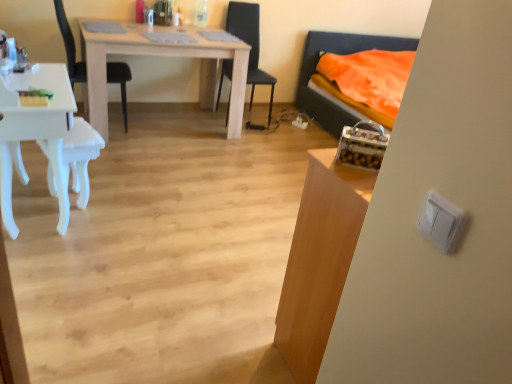
Question: Could you tell me if light wood table at center, which is the 1th table in back-to-front order, is facing black plastic chair at upper left, the 1th chair in the left-to-right sequence?

Choices:
 (A) no
 (B) yes

Answer: (A)

Question: Would you consider light wood table at center, which appears as the first table when viewed from the left, to be distant from black plastic chair at upper left, the 1th chair in the left-to-right sequence?

Choices:
 (A) yes
 (B) no

Answer: (B)

Question: From the image's perspective, would you say light wood table at center, which is the 1th table in back-to-front order, is shown under black plastic chair at upper left, the 1th chair in the left-to-right sequence?

Choices:
 (A) yes
 (B) no

Answer: (A)

Question: Does light wood table at center, arranged as the 2th table when viewed from the right, have a smaller size compared to black plastic chair at upper left, the 1th chair in the left-to-right sequence?

Choices:
 (A) no
 (B) yes

Answer: (A)

Question: Is light wood table at center, arranged as the 2th table when viewed from the right, bigger than black plastic chair at upper left, arranged as the second chair when viewed from the right?

Choices:
 (A) yes
 (B) no

Answer: (A)

Question: Is light wood table at center, which is the 2th table in front-to-back order, positioned before black plastic chair at upper left, the 1th chair in the left-to-right sequence?

Choices:
 (A) no
 (B) yes

Answer: (B)

Question: Is the position of white plastic light switch at right more distant than that of white glossy armchair at lower left?

Choices:
 (A) no
 (B) yes

Answer: (A)

Question: From the image's perspective, is white plastic light switch at right below white glossy armchair at lower left?

Choices:
 (A) no
 (B) yes

Answer: (B)

Question: Can you confirm if white plastic light switch at right is thinner than white glossy armchair at lower left?

Choices:
 (A) no
 (B) yes

Answer: (B)

Question: From the image's perspective, does white plastic light switch at right appear higher than white glossy armchair at lower left?

Choices:
 (A) yes
 (B) no

Answer: (B)

Question: Can you confirm if white plastic light switch at right is shorter than white glossy armchair at lower left?

Choices:
 (A) no
 (B) yes

Answer: (B)

Question: Would you say white glossy armchair at lower left is part of white plastic light switch at right's contents?

Choices:
 (A) no
 (B) yes

Answer: (A)

Question: Is white plastic light switch at right taller than white glossy desk at left?

Choices:
 (A) yes
 (B) no

Answer: (B)